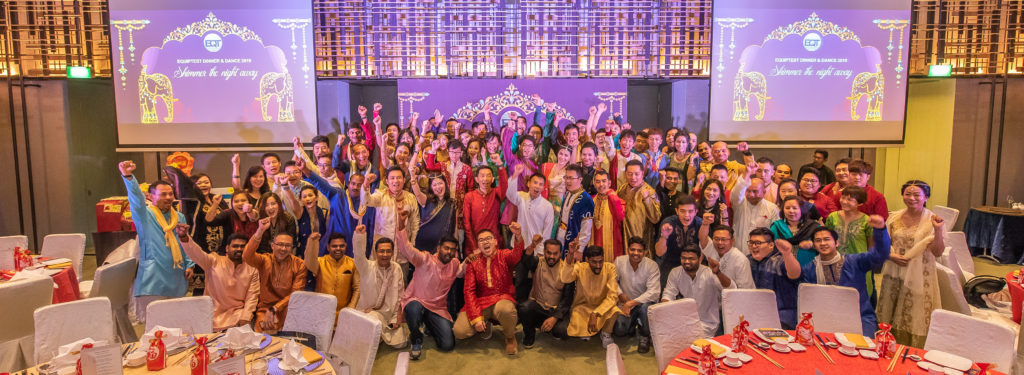
What are the coordinates of `walls` in the screenshot? It's located at (983, 143), (38, 128).